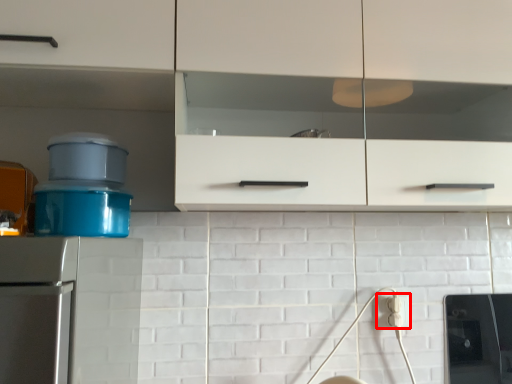
Question: Where is electric outlet (annotated by the red box) located in relation to cabinetry in the image?

Choices:
 (A) left
 (B) right

Answer: (B)